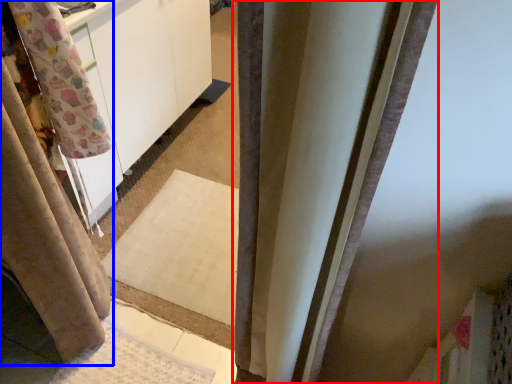
Question: Among these objects, which one is farthest to the camera, curtain (highlighted by a red box) or curtain (highlighted by a blue box)?

Choices:
 (A) curtain
 (B) curtain

Answer: (B)